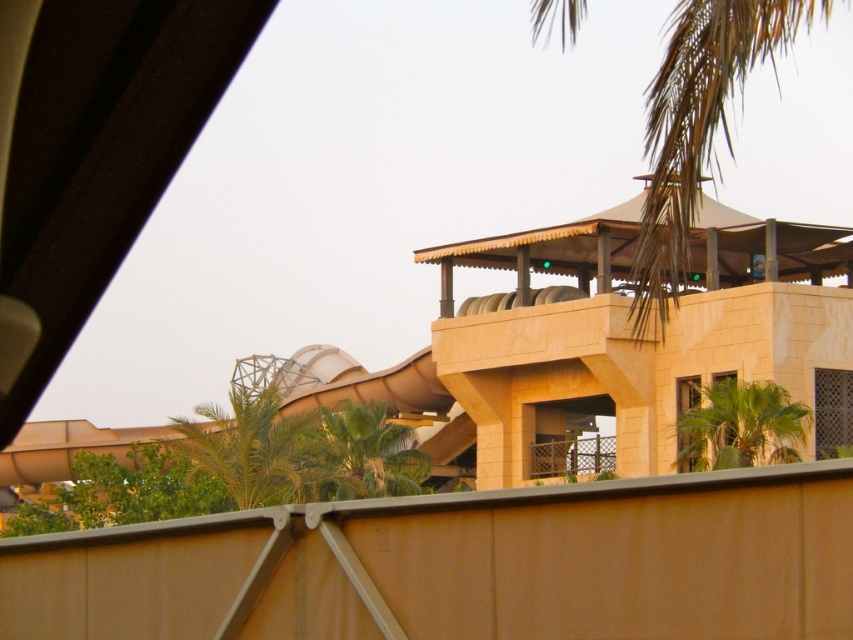
You are standing in front of the beige building and want to walk from the green leafy palm tree at lower left to the green leafy palm tree at lower right. Which direction should you walk to move away from the building?

You should walk towards the green leafy palm tree at lower right because it is farther from the building compared to the green leafy palm tree at lower left.

You are standing at the center of the image. Which direction should you walk to reach the green leafy palm tree at lower left?

You should walk towards the lower left direction to reach the green leafy palm tree at lower left.